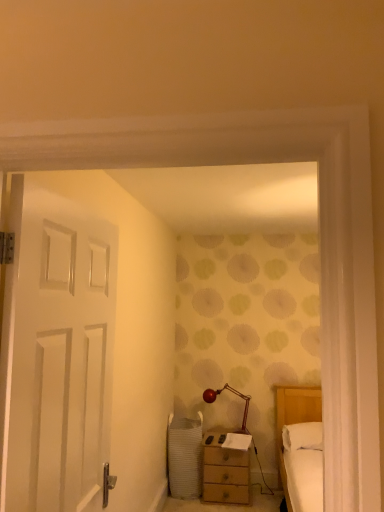
Question: From a real-world perspective, is wooden nightstand at lower center over white matte door at left?

Choices:
 (A) no
 (B) yes

Answer: (A)

Question: Can you confirm if wooden nightstand at lower center is shorter than white matte door at left?

Choices:
 (A) no
 (B) yes

Answer: (B)

Question: Is wooden nightstand at lower center facing towards white matte door at left?

Choices:
 (A) yes
 (B) no

Answer: (A)

Question: Is wooden nightstand at lower center taller than white matte door at left?

Choices:
 (A) no
 (B) yes

Answer: (A)

Question: Is wooden nightstand at lower center smaller than white matte door at left?

Choices:
 (A) yes
 (B) no

Answer: (B)

Question: Are wooden nightstand at lower center and white matte door at left located far from each other?

Choices:
 (A) yes
 (B) no

Answer: (A)

Question: Considering the relative sizes of shiny red glass table lamp at center and white matte door at left in the image provided, is shiny red glass table lamp at center shorter than white matte door at left?

Choices:
 (A) no
 (B) yes

Answer: (B)

Question: From the image's perspective, is shiny red glass table lamp at center beneath white matte door at left?

Choices:
 (A) no
 (B) yes

Answer: (B)

Question: From the image's perspective, is shiny red glass table lamp at center above white matte door at left?

Choices:
 (A) yes
 (B) no

Answer: (B)

Question: Does shiny red glass table lamp at center have a greater height compared to white matte door at left?

Choices:
 (A) no
 (B) yes

Answer: (A)

Question: Is shiny red glass table lamp at center placed right next to white matte door at left?

Choices:
 (A) yes
 (B) no

Answer: (B)

Question: Does shiny red glass table lamp at center have a lesser width compared to white matte door at left?

Choices:
 (A) yes
 (B) no

Answer: (B)

Question: Is white soft pillow at right touching wooden nightstand at lower center?

Choices:
 (A) yes
 (B) no

Answer: (B)